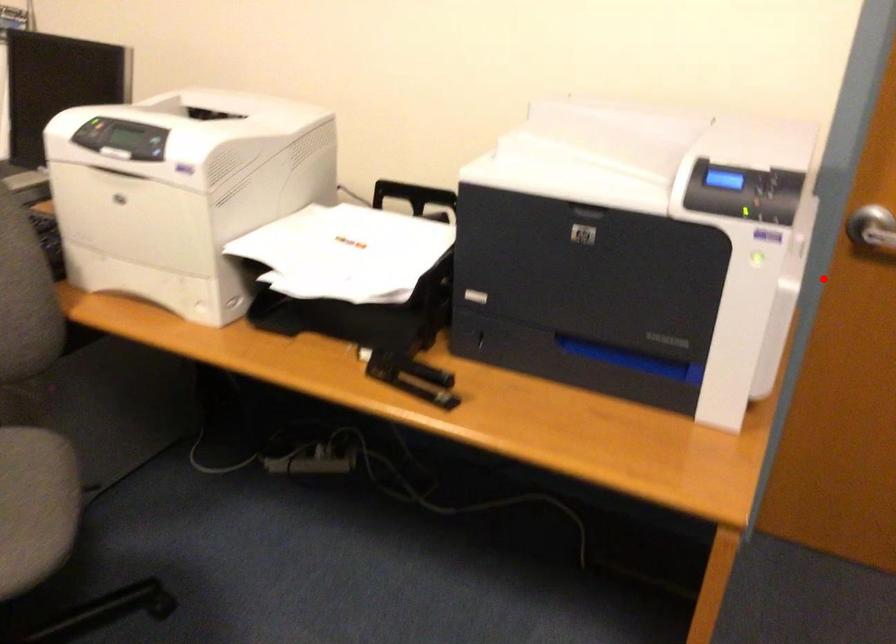
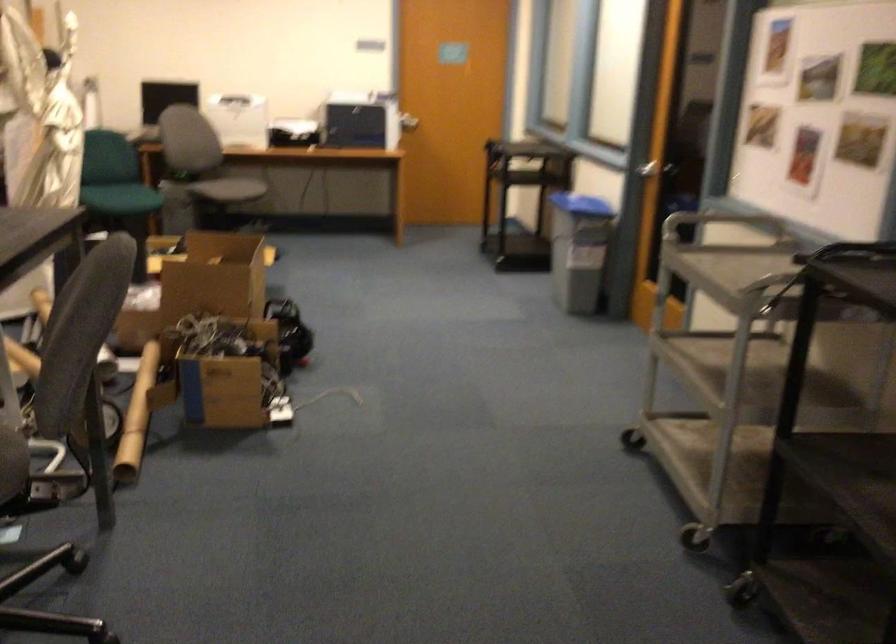
The point at the highlighted location is marked in the first image. Where is the corresponding point in the second image?

(409, 122)